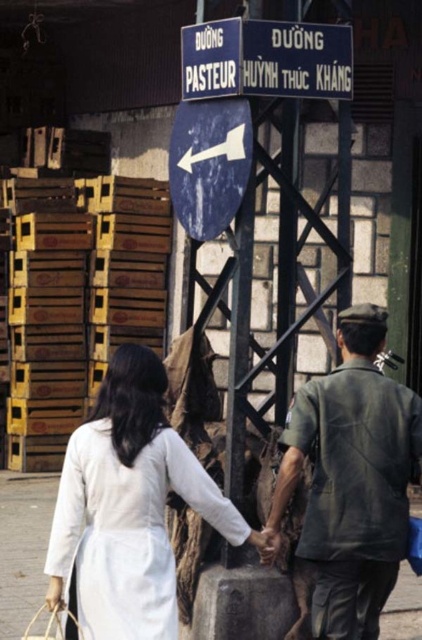
Question: Is white cotton ao dai at center to the right of blue painted metal sign at upper center from the viewer's perspective?

Choices:
 (A) no
 (B) yes

Answer: (A)

Question: Which point is closer to the camera?

Choices:
 (A) (370, 588)
 (B) (210, 128)

Answer: (A)

Question: Among these objects, which one is nearest to the camera?

Choices:
 (A) blue matte sign at center
 (B) dark green uniform at center

Answer: (B)

Question: Does white cotton ao dai at center come in front of blue matte sign at center?

Choices:
 (A) no
 (B) yes

Answer: (B)

Question: Which of the following is the closest to the observer?

Choices:
 (A) dark green uniform at center
 (B) white cotton ao dai at center
 (C) blue painted metal sign at upper center

Answer: (B)

Question: Does white cotton ao dai at center have a lesser width compared to dark green uniform at center?

Choices:
 (A) no
 (B) yes

Answer: (A)